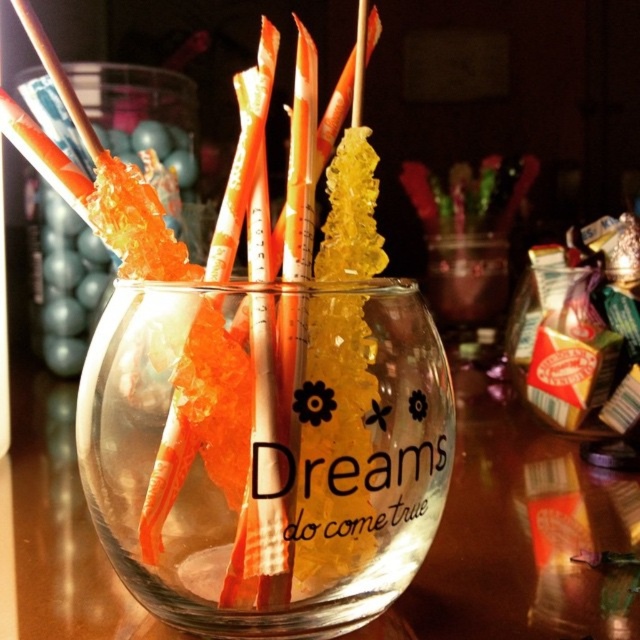
You are at a party and want to serve drinks in the transparent glass vase at center. However, you have a long translucent paper straw at center that needs to fit inside. Can the straw fit inside the vase?

The transparent glass vase at center has a larger size compared to translucent paper straw at center, so the straw can fit inside the vase.

You are at a party and need to place a 10cm wide candle into the transparent glass vase at center. The translucent paper straw at center is already inside it. Can the candle fit inside the vase?

The transparent glass vase at center is wider than the translucent paper straw at center. Since the candle is 10cm wide and the vase is wider than the straw, it should fit as long as the vase can accommodate the candle.

You are a customer at a candy shop holding a 1.5 inch wide box. You want to place it between the transparent glass vase at center and the translucent paper straw at center. Is there enough space?

The transparent glass vase at center and the translucent paper straw at center are 0.91 inches apart. Since the box is 1.5 inches wide, which is wider than the available space, it won t fit between them.